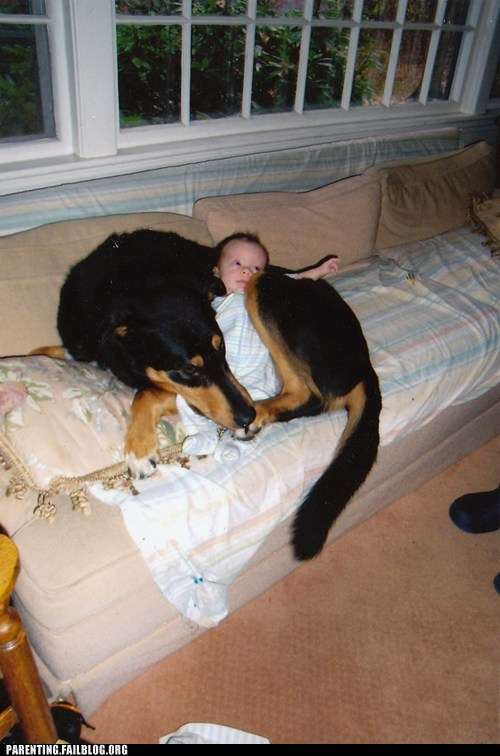
Locate an element on the screen. sheet is located at coordinates (419, 298).